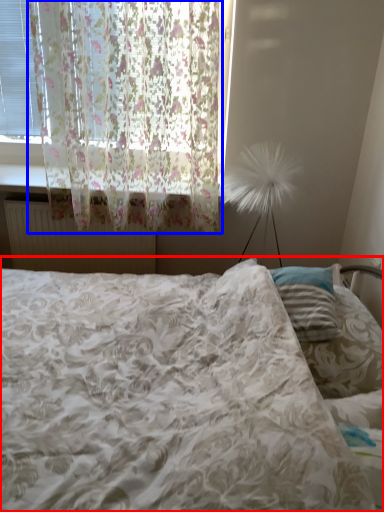
Question: Which of the following is the farthest to the observer, bed (highlighted by a red box) or curtain (highlighted by a blue box)?

Choices:
 (A) bed
 (B) curtain

Answer: (B)